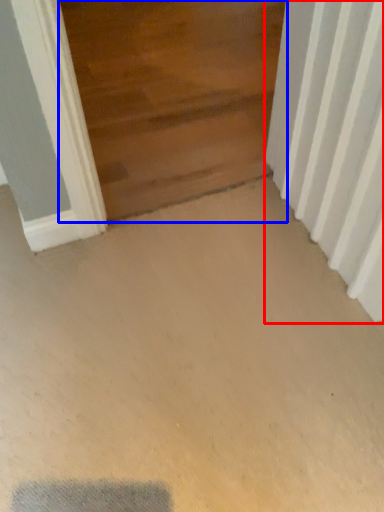
Question: Which of the following is the closest to the observer, radiator (highlighted by a red box) or door (highlighted by a blue box)?

Choices:
 (A) radiator
 (B) door

Answer: (A)